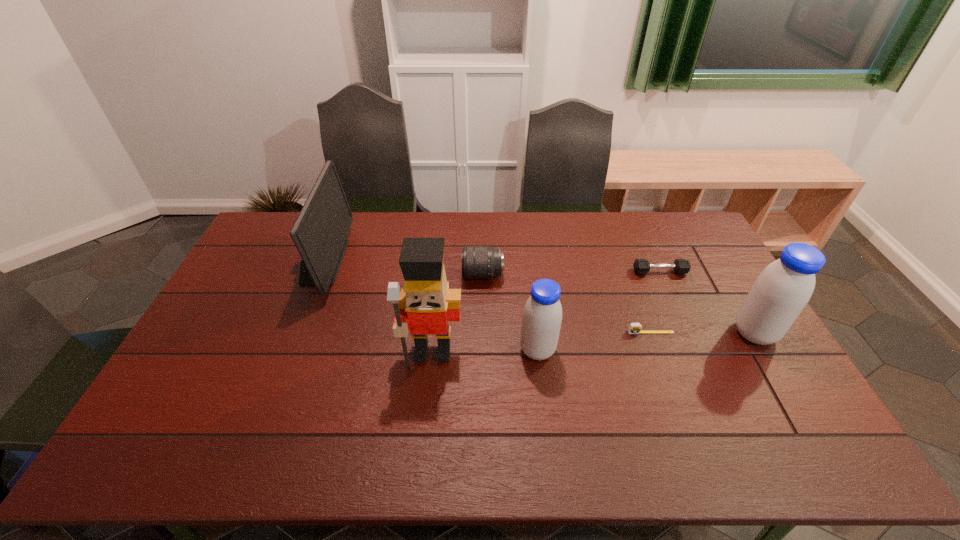
The width and height of the screenshot is (960, 540). What are the coordinates of `dumbbell located in the right edge section of the desktop` in the screenshot? It's located at (641, 266).

Locate an element on the screen. vacant space at the far edge of the desktop is located at coordinates (479, 231).

The image size is (960, 540). I want to click on free spot at the near edge of the desktop, so click(x=690, y=400).

Image resolution: width=960 pixels, height=540 pixels. In the image, there is a desktop. What are the coordinates of `vacant space at the left edge` in the screenshot? It's located at (269, 269).

In order to click on free spot at the right edge of the desktop in this screenshot , I will do `click(747, 380)`.

In the image, there is a desktop. What are the coordinates of `vacant space at the far right corner` in the screenshot? It's located at (682, 231).

The image size is (960, 540). In order to click on free spot between the computer monitor and the shortest object in this screenshot , I will do `click(487, 297)`.

I want to click on empty space between the tape measure and the right soya milk, so click(x=703, y=333).

What are the coordinates of `free space between the right soya milk and the left soya milk` in the screenshot? It's located at (646, 342).

Locate an element on the screen. vacant area between the dumbbell and the fifth tallest object is located at coordinates (571, 273).